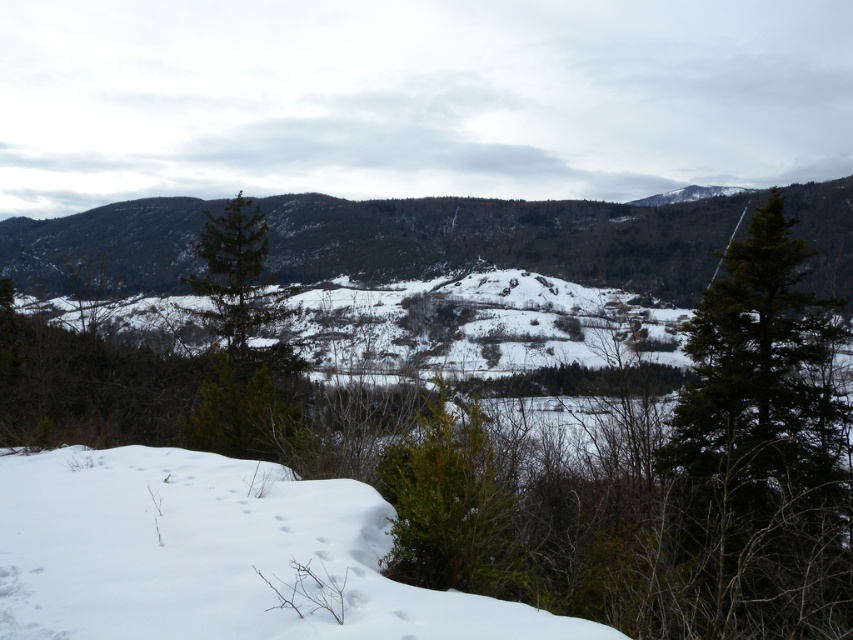
Question: Which object is the closest to the white snow at lower left?

Choices:
 (A) green matte tree at right
 (B) green matte tree at center

Answer: (A)

Question: In this image, where is white snow at lower left located relative to green matte tree at right?

Choices:
 (A) below
 (B) above

Answer: (B)

Question: Which point is farther to the camera?

Choices:
 (A) green matte tree at center
 (B) white snow at lower left

Answer: (A)

Question: Can you confirm if white snow at lower left is bigger than green matte tree at right?

Choices:
 (A) no
 (B) yes

Answer: (A)

Question: Is white snow at lower left above green matte tree at right?

Choices:
 (A) yes
 (B) no

Answer: (A)

Question: Which point is closer to the camera taking this photo?

Choices:
 (A) (234, 413)
 (B) (766, 522)

Answer: (A)